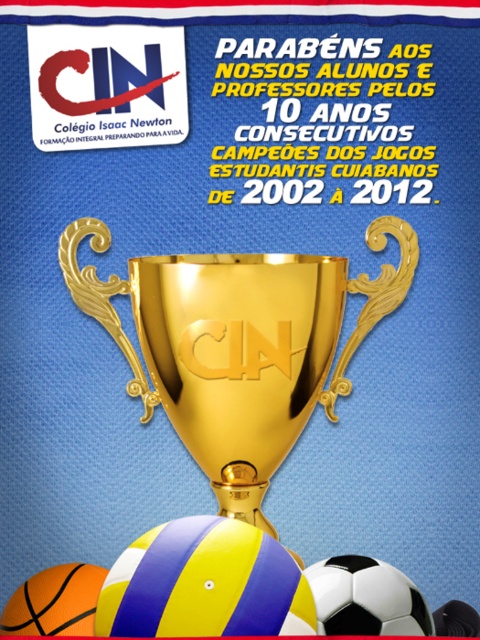
Question: Is yellowmattebeach ball at center bigger than yellow matte beach ball at lower center?

Choices:
 (A) no
 (B) yes

Answer: (B)

Question: Which object appears closest to the camera in this image?

Choices:
 (A) white matte beach ball at lower center
 (B) yellow matte beach ball at lower center
 (C) gold shiny trophy cup at center

Answer: (A)

Question: Does yellowmattebeach ball at center appear on the right side of white matte beach ball at lower center?

Choices:
 (A) no
 (B) yes

Answer: (A)

Question: Among these points, which one is farthest from the camera?

Choices:
 (A) (71, 593)
 (B) (252, 481)
 (C) (399, 595)

Answer: (B)

Question: Which object is closer to the camera taking this photo?

Choices:
 (A) gold shiny trophy cup at center
 (B) yellow matte beach ball at lower center
 (C) white matte beach ball at lower center

Answer: (C)

Question: From the image, what is the correct spatial relationship of yellowmattebeach ball at center in relation to yellow matte beach ball at lower center?

Choices:
 (A) below
 (B) above

Answer: (B)